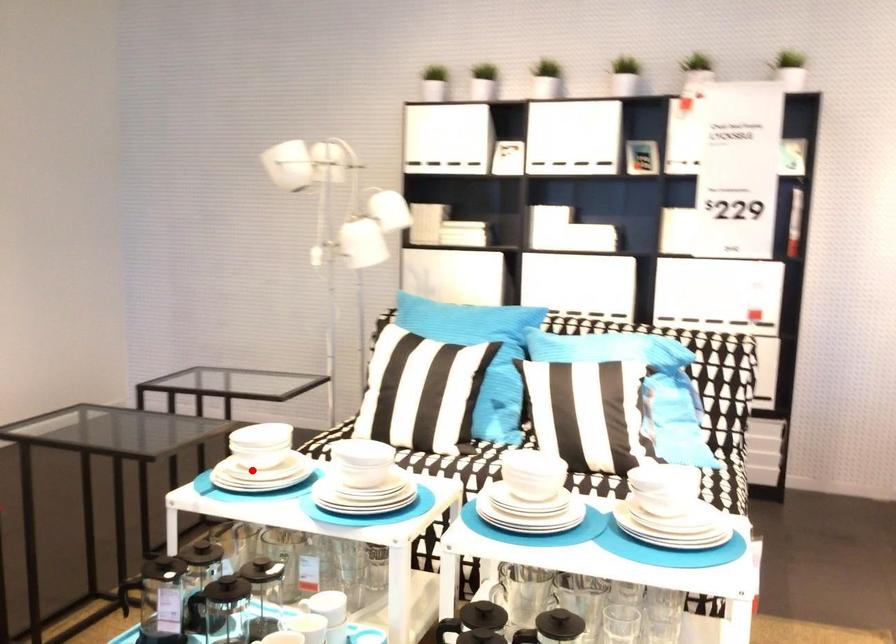
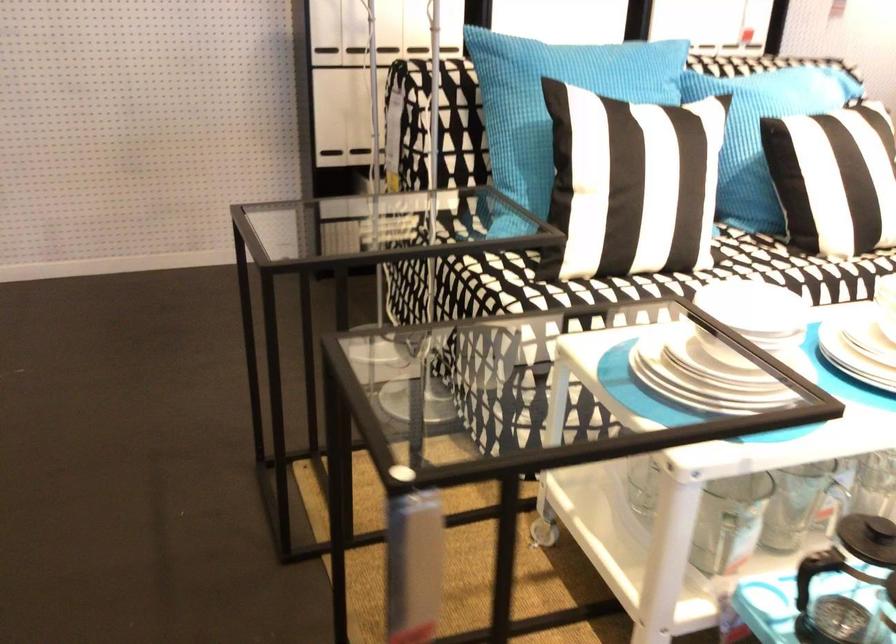
Where in the second image is the point corresponding to the highlighted location from the first image?

(709, 373)